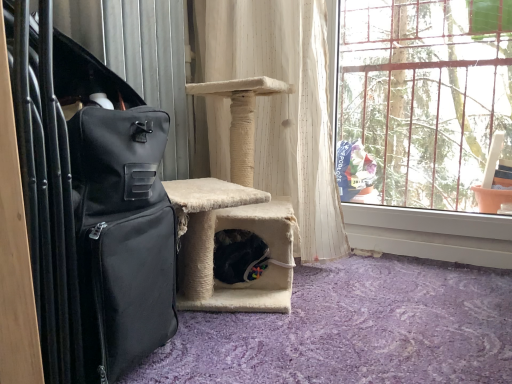
Question: Considering the relative positions of clear glass window at upper right and black fabric suitcase at left in the image provided, is clear glass window at upper right to the right of black fabric suitcase at left from the viewer's perspective?

Choices:
 (A) yes
 (B) no

Answer: (A)

Question: Does clear glass window at upper right have a larger size compared to black fabric suitcase at left?

Choices:
 (A) yes
 (B) no

Answer: (B)

Question: Is clear glass window at upper right oriented away from black fabric suitcase at left?

Choices:
 (A) yes
 (B) no

Answer: (B)

Question: Is clear glass window at upper right next to black fabric suitcase at left and touching it?

Choices:
 (A) yes
 (B) no

Answer: (B)

Question: Considering the relative sizes of clear glass window at upper right and black fabric suitcase at left in the image provided, is clear glass window at upper right taller than black fabric suitcase at left?

Choices:
 (A) no
 (B) yes

Answer: (B)

Question: Is clear glass window at upper right further to camera compared to black fabric suitcase at left?

Choices:
 (A) no
 (B) yes

Answer: (B)

Question: Does black fabric suitcase at left have a smaller size compared to white textured curtain at center?

Choices:
 (A) yes
 (B) no

Answer: (A)

Question: Can white textured curtain at center be found inside black fabric suitcase at left?

Choices:
 (A) no
 (B) yes

Answer: (A)

Question: Does black fabric suitcase at left have a greater height compared to white textured curtain at center?

Choices:
 (A) no
 (B) yes

Answer: (A)

Question: From a real-world perspective, is black fabric suitcase at left located higher than white textured curtain at center?

Choices:
 (A) no
 (B) yes

Answer: (A)

Question: From a real-world perspective, is black fabric suitcase at left physically below white textured curtain at center?

Choices:
 (A) no
 (B) yes

Answer: (B)

Question: Is black fabric suitcase at left at the left side of white textured curtain at center?

Choices:
 (A) yes
 (B) no

Answer: (A)

Question: Is black fabric suitcase at left to the right of clear glass window at upper right from the viewer's perspective?

Choices:
 (A) yes
 (B) no

Answer: (B)